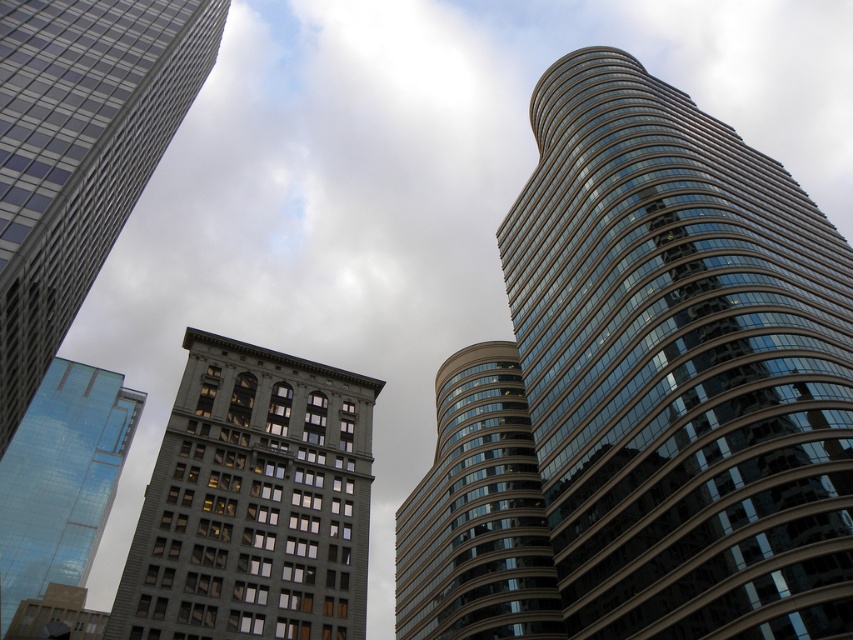
You are an architect analyzing the city layout. You observe the matte glass skyscraper at center and the glassy reflective building at center. Which of these two buildings is located to the left of the other?

The matte glass skyscraper at center is positioned on the left side of the glassy reflective building at center.

From the picture: You are standing in the city and see the glassy reflective building at right. Is the point at coordinate (680, 365) located on this building?

Yes, the point at coordinate (680, 365) is located on the glassy reflective building at right as stated in the objects description.

You are standing in the city looking at the skyscrapers. There are two points marked on the image, point 1 at coordinates (558, 618) and point 2 at (70, 449). Which point is closer to you?

Point 1 at coordinates (558, 618) is closer to you than point 2 at (70, 449).